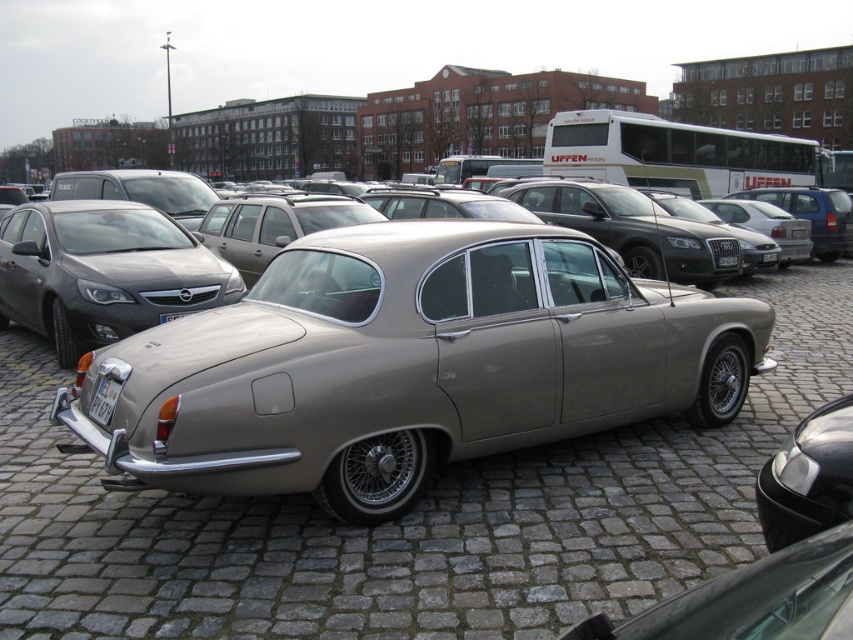
Is metallic silver car at center below satin silver car at center?

No, metallic silver car at center is not below satin silver car at center.

Does point (386, 552) come behind point (824, 426)?

Yes, it is behind point (824, 426).

Where is `metallic silver car at center`? Image resolution: width=853 pixels, height=640 pixels. metallic silver car at center is located at coordinates click(407, 518).

Can you confirm if satin silver car at left is smaller than satin silver car at center?

Incorrect, satin silver car at left is not smaller in size than satin silver car at center.

Does satin silver car at left come behind satin silver car at center?

Yes, satin silver car at left is further from the viewer.

Identify the location of satin silver car at left. (102, 272).

Where is `white plastic license plate at lower left`? The height and width of the screenshot is (640, 853). white plastic license plate at lower left is located at coordinates (105, 394).

From the picture: How distant is white plastic license plate at lower left from white plastic license plate at center?

They are 3.26 meters apart.

The image size is (853, 640). I want to click on white plastic license plate at lower left, so click(x=105, y=394).